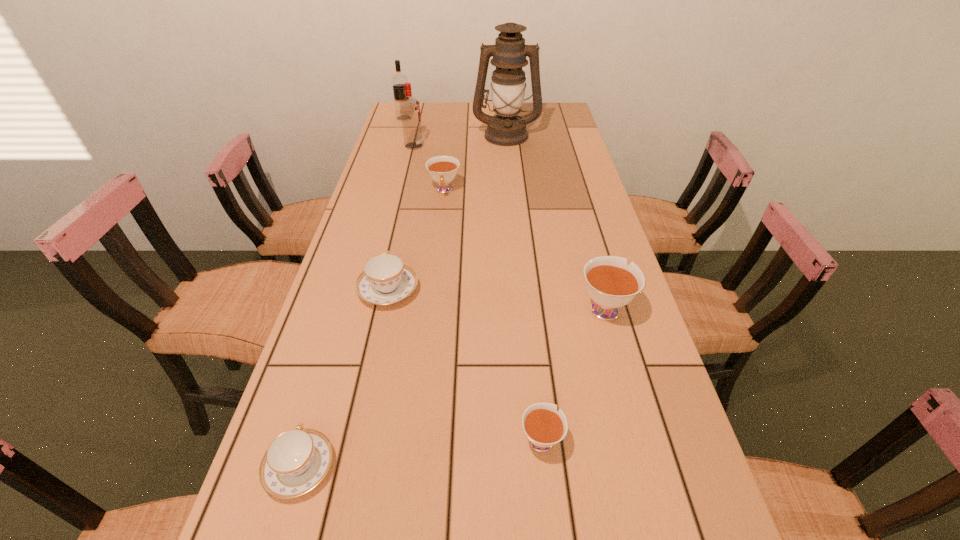
At what (x,y) coordinates should I click in order to perform the action: click on white teacup that stands as the closest to the oil lamp. Please return your answer as a coordinate pair (x, y). Looking at the image, I should click on (443, 169).

Locate which blue teacup ranks in proximity to the farthest teacup. Please provide its 2D coordinates. Your answer should be formatted as a tuple, i.e. [(x, y)], where the tuple contains the x and y coordinates of a point satisfying the conditions above.

[(385, 280)]

You are a GUI agent. You are given a task and a screenshot of the screen. Output one action in this format:
    pyautogui.click(x=<x>, y=<y>)
    Task: Click on the blue teacup that stands as the second closest to the second nearest white teacup
    This screenshot has height=540, width=960.
    Given the screenshot: What is the action you would take?
    pyautogui.click(x=297, y=460)

Locate an element on the screen. This screenshot has width=960, height=540. free point that satisfies the following two spatial constraints: 1. on the label of the farthest object; 2. on the side of the nearest white teacup with the handle is located at coordinates coord(308,439).

Locate an element on the screen. The width and height of the screenshot is (960, 540). free region that satisfies the following two spatial constraints: 1. on the label of the farther vodka; 2. on the right side of the oil lamp is located at coordinates (399, 135).

Identify the location of blank space that satisfies the following two spatial constraints: 1. on the side with the handle of the bigger blue teacup; 2. on the label of the farther vodka. (425, 118).

Where is `vacant region that satisfies the following two spatial constraints: 1. on the side of the rightmost white teacup with the handle; 2. on the label of the farthest object`? Image resolution: width=960 pixels, height=540 pixels. vacant region that satisfies the following two spatial constraints: 1. on the side of the rightmost white teacup with the handle; 2. on the label of the farthest object is located at coordinates (551, 118).

Where is `vacant space that satisfies the following two spatial constraints: 1. on the side of the tallest teacup with the handle; 2. on the label of the farthest object`? The height and width of the screenshot is (540, 960). vacant space that satisfies the following two spatial constraints: 1. on the side of the tallest teacup with the handle; 2. on the label of the farthest object is located at coordinates (551, 118).